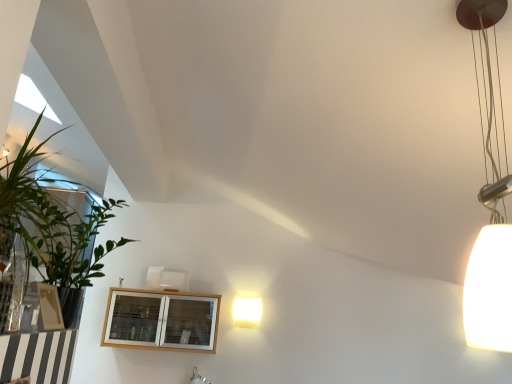
Question: Does wooden cabinet at lower left turn towards matte white lamp at center, which appears as the 2th lamp when viewed from the top?

Choices:
 (A) yes
 (B) no

Answer: (B)

Question: Is wooden cabinet at lower left far from matte white lamp at center, which appears as the 2th lamp when viewed from the top?

Choices:
 (A) no
 (B) yes

Answer: (A)

Question: Considering the relative positions of wooden cabinet at lower left and matte white lamp at center, which is the first lamp from left to right, in the image provided, is wooden cabinet at lower left to the right of matte white lamp at center, which is the first lamp from left to right, from the viewer's perspective?

Choices:
 (A) yes
 (B) no

Answer: (B)

Question: Can you confirm if wooden cabinet at lower left is smaller than matte white lamp at center, which appears as the 2th lamp when viewed from the top?

Choices:
 (A) yes
 (B) no

Answer: (B)

Question: Is wooden cabinet at lower left thinner than matte white lamp at center, the 1th lamp when ordered from bottom to top?

Choices:
 (A) no
 (B) yes

Answer: (A)

Question: Considering the positions of point (101, 342) and point (483, 31), is point (101, 342) closer or farther from the camera than point (483, 31)?

Choices:
 (A) closer
 (B) farther

Answer: (B)

Question: Based on their sizes in the image, would you say wooden cabinet at lower left is bigger or smaller than white matte lampshade at right, marked as the 2th lamp in a back-to-front arrangement?

Choices:
 (A) small
 (B) big

Answer: (B)

Question: In terms of height, does wooden cabinet at lower left look taller or shorter compared to white matte lampshade at right, marked as the 2th lamp in a back-to-front arrangement?

Choices:
 (A) short
 (B) tall

Answer: (A)

Question: From the image's perspective, is wooden cabinet at lower left located above or below white matte lampshade at right, marked as the 2th lamp in a back-to-front arrangement?

Choices:
 (A) below
 (B) above

Answer: (A)

Question: Is matte white lamp at center, which appears as the 2th lamp when viewed from the top, bigger or smaller than green leafy plant at left?

Choices:
 (A) small
 (B) big

Answer: (A)

Question: From a real-world perspective, is matte white lamp at center, arranged as the first lamp when viewed from the back, above or below green leafy plant at left?

Choices:
 (A) above
 (B) below

Answer: (B)

Question: Is matte white lamp at center, which is the first lamp from left to right, wider or thinner than green leafy plant at left?

Choices:
 (A) thin
 (B) wide

Answer: (A)

Question: Is matte white lamp at center, which appears as the 2th lamp when viewed from the top, taller or shorter than green leafy plant at left?

Choices:
 (A) short
 (B) tall

Answer: (A)

Question: Considering the positions of matte white lamp at center, which is the 2th lamp from front to back, and wooden cabinet at lower left in the image, is matte white lamp at center, which is the 2th lamp from front to back, bigger or smaller than wooden cabinet at lower left?

Choices:
 (A) small
 (B) big

Answer: (A)

Question: Is point (245, 306) closer or farther from the camera than point (203, 301)?

Choices:
 (A) farther
 (B) closer

Answer: (A)